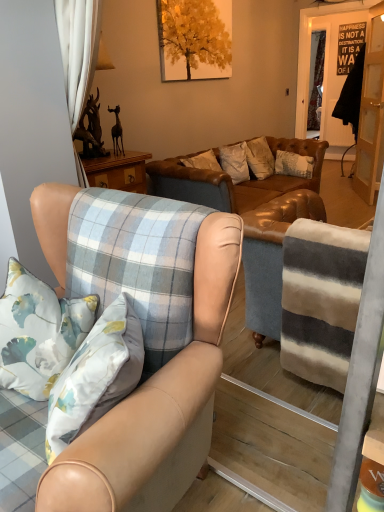
Question: In terms of height, does leather couch at center look taller or shorter compared to clear glass door at right?

Choices:
 (A) short
 (B) tall

Answer: (A)

Question: From a real-world perspective, is leather couch at center physically located above or below clear glass door at right?

Choices:
 (A) below
 (B) above

Answer: (A)

Question: Based on their relative distances, which object is nearer to the leather couch at center?

Choices:
 (A) white floral pillow at left
 (B) light brown leather armchair at center
 (C) clear glass door at right

Answer: (C)

Question: Which of these objects is positioned farthest from the clear glass door at right?

Choices:
 (A) light brown leather armchair at center
 (B) white floral pillow at left
 (C) leather couch at center

Answer: (A)